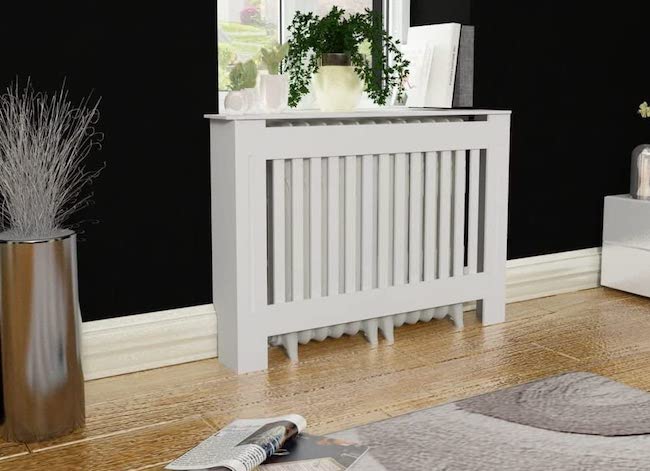
Find the location of a particular element. The height and width of the screenshot is (471, 650). book is located at coordinates (465, 65), (452, 56), (422, 70), (292, 451).